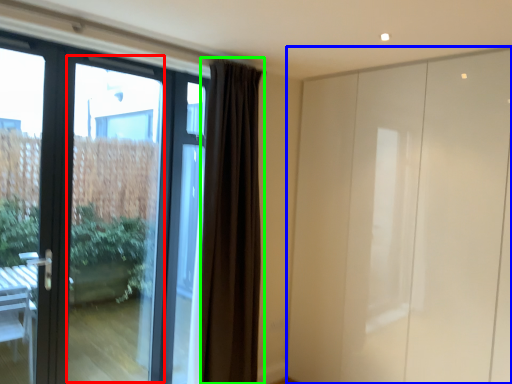
Question: Which is farther away from glass door (highlighted by a red box)? screen door (highlighted by a blue box) or curtain (highlighted by a green box)?

Choices:
 (A) screen door
 (B) curtain

Answer: (A)